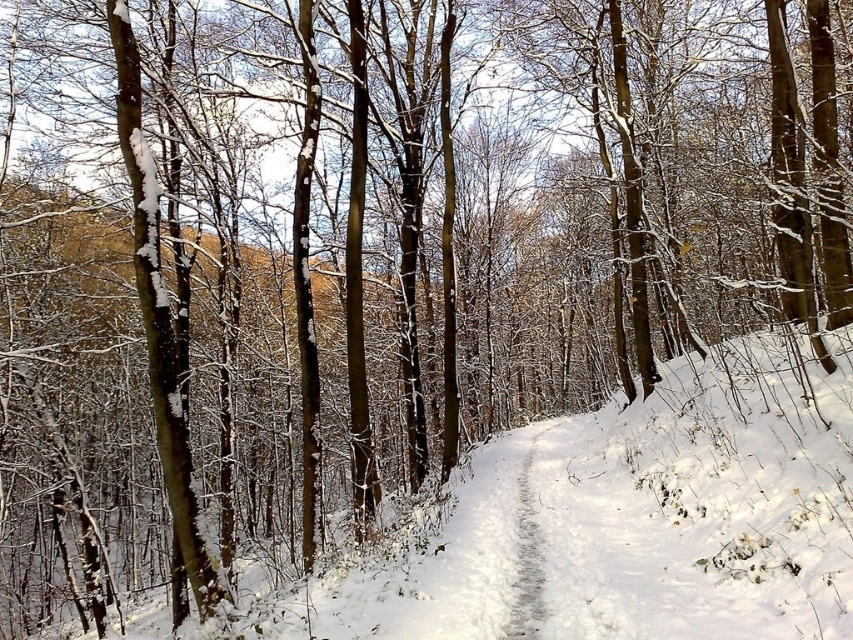
Does point (791, 580) lie in front of point (517, 522)?

Yes, point (791, 580) is closer to viewer.

Between white fluffy snow at center and gray textured trail at center, which one is positioned lower?

Positioned lower is gray textured trail at center.

Is point (468, 536) in front of point (535, 525)?

That is True.

The image size is (853, 640). I want to click on white fluffy snow at center, so click(631, 518).